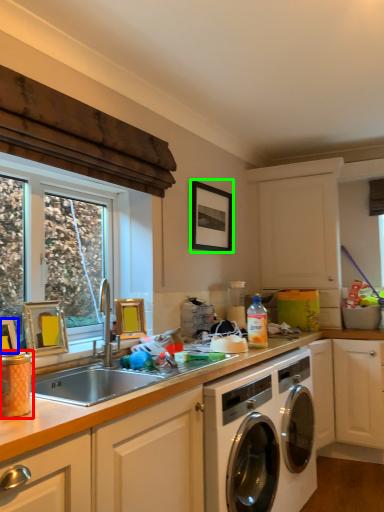
Question: Which is farther away from appliance (highlighted by a red box)? picture frame (highlighted by a blue box) or picture frame (highlighted by a green box)?

Choices:
 (A) picture frame
 (B) picture frame

Answer: (B)